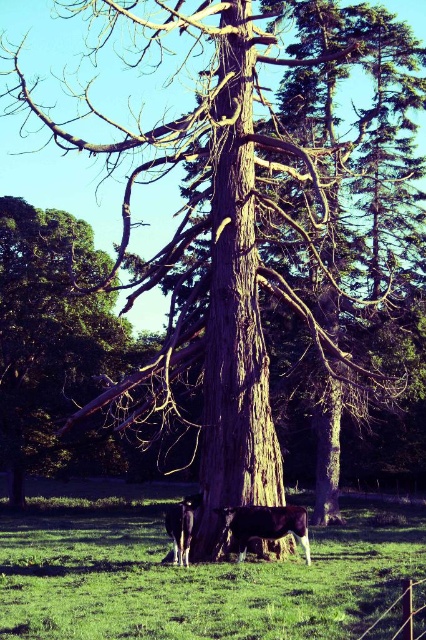
Question: Is black glossy cow at center further to camera compared to brown glossy cow at lower center?

Choices:
 (A) no
 (B) yes

Answer: (A)

Question: Does green leafy tree at left come in front of black glossy cow at center?

Choices:
 (A) yes
 (B) no

Answer: (B)

Question: Is green leafy tree at left closer to the viewer compared to black glossy cow at center?

Choices:
 (A) no
 (B) yes

Answer: (A)

Question: Which point is farther to the camera?

Choices:
 (A) black glossy cow at center
 (B) brown glossy cow at lower center
 (C) green grass at lower center
 (D) green leafy tree at left

Answer: (D)

Question: Which of the following is the farthest from the observer?

Choices:
 (A) (368, 550)
 (B) (184, 509)

Answer: (A)

Question: Estimate the real-world distances between objects in this image. Which object is closer to the black glossy cow at center?

Choices:
 (A) green leafy tree at left
 (B) green grass at lower center

Answer: (B)